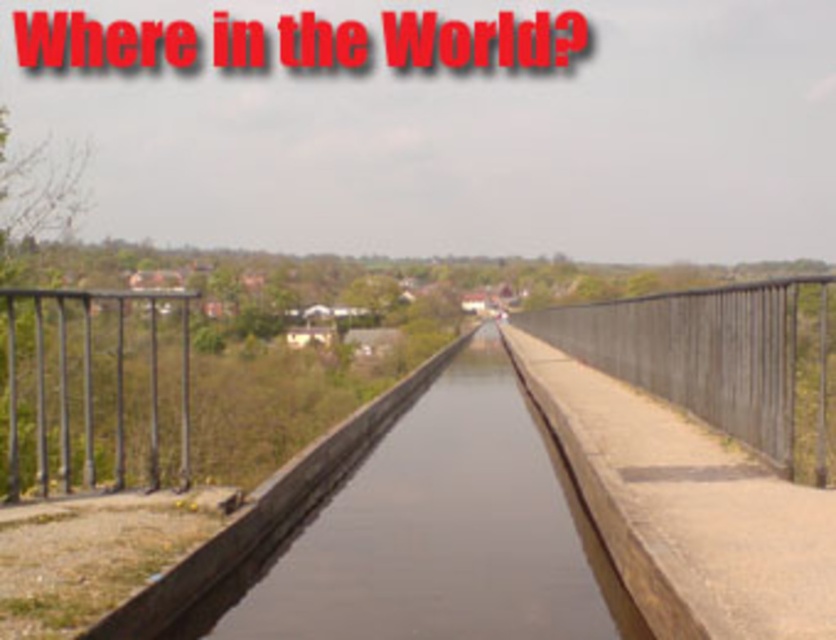
You are a painter standing at the end of the canal and want to paint both the metallic gray rail at right and the black metal railing at left. Which one appears larger in your painting?

The metallic gray rail at right appears larger in your painting because it is bigger than the black metal railing at left.

You are standing at the starting point of the canal and want to reach the metallic gray rail at right located at point (722, 358). Which direction should you walk to reach it?

You should walk forward along the canal towards the point (722, 358) to reach the metallic gray rail at right.